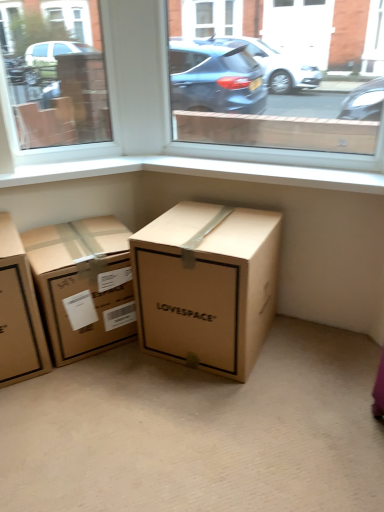
The image size is (384, 512). Find the location of `transparent glass window at center, the 1th window in the right-to-left sequence`. transparent glass window at center, the 1th window in the right-to-left sequence is located at coordinates click(x=151, y=104).

Where is `brown cardboard box at left, the third box from the right`? This screenshot has height=512, width=384. brown cardboard box at left, the third box from the right is located at coordinates (18, 312).

Who is bigger, white smooth window sill at upper center or brown cardboard box at left, the third box from the right?

With larger size is brown cardboard box at left, the third box from the right.

How many degrees apart are the facing directions of white smooth window sill at upper center and brown cardboard box at left, the third box from the right?

There is a 52.1-degree angle between the facing directions of white smooth window sill at upper center and brown cardboard box at left, the third box from the right.

Consider the image. Is white smooth window sill at upper center not inside brown cardboard box at left, the third box from the right?

Indeed, white smooth window sill at upper center is completely outside brown cardboard box at left, the third box from the right.

Considering the relative sizes of white smooth window sill at upper center and brown cardboard box at left, the third box from the right, in the image provided, is white smooth window sill at upper center thinner than brown cardboard box at left, the third box from the right,?

Indeed, white smooth window sill at upper center has a lesser width compared to brown cardboard box at left, the third box from the right.

Would you say brown cardboard box at center, positioned as the second box in left-to-right order, contains brown cardboard box at left, the first box viewed from the left?

Definitely not — brown cardboard box at left, the first box viewed from the left, is not inside brown cardboard box at center, positioned as the second box in left-to-right order.

From a real-world perspective, between brown cardboard box at center, positioned as the second box in left-to-right order, and brown cardboard box at left, the first box viewed from the left, who is vertically lower?

From a 3D spatial view, brown cardboard box at center, positioned as the second box in left-to-right order, is below.

Looking at their sizes, would you say brown cardboard box at center, which is the 2th box in right-to-left order, is wider or thinner than brown cardboard box at left, the first box viewed from the left?

Clearly, brown cardboard box at center, which is the 2th box in right-to-left order, has less width compared to brown cardboard box at left, the first box viewed from the left.

Is brown cardboard box at center, positioned as the second box in left-to-right order, turned away from brown cardboard box at left, the third box from the right?

No, brown cardboard box at center, positioned as the second box in left-to-right order, is not facing away from brown cardboard box at left, the third box from the right.

Would you say brown cardboard box at left, the first box viewed from the left, is to the left or to the right of white smooth window sill at upper center in the picture?

brown cardboard box at left, the first box viewed from the left, is positioned on white smooth window sill at upper center's left side.

Locate an element on the screen. The image size is (384, 512). window sill behind the brown cardboard box at left, the third box from the right is located at coordinates (199, 172).

Is brown cardboard box at left, the first box viewed from the left, oriented towards white smooth window sill at upper center?

No, brown cardboard box at left, the first box viewed from the left, is not facing towards white smooth window sill at upper center.

Consider the image. Which object is thinner, brown cardboard box at left, the third box from the right, or white smooth window sill at upper center?

Thinner between the two is white smooth window sill at upper center.

From the picture: Is brown cardboard box at center, positioned as the first box in right-to-left order, inside the boundaries of brown cardboard box at center, which is the 2th box in right-to-left order, or outside?

brown cardboard box at center, positioned as the first box in right-to-left order, cannot be found inside brown cardboard box at center, which is the 2th box in right-to-left order.

From a real-world perspective, relative to brown cardboard box at center, which is the 2th box in right-to-left order, is brown cardboard box at center, positioned as the first box in right-to-left order, vertically above or below?

brown cardboard box at center, positioned as the first box in right-to-left order, is above brown cardboard box at center, which is the 2th box in right-to-left order.

I want to click on box on the right of brown cardboard box at center, positioned as the second box in left-to-right order, so click(x=207, y=284).

How far apart are brown cardboard box at center, the 3th box in the left-to-right sequence, and brown cardboard box at center, which is the 2th box in right-to-left order?

The distance of brown cardboard box at center, the 3th box in the left-to-right sequence, from brown cardboard box at center, which is the 2th box in right-to-left order, is 10.74 inches.

Considering the relative positions of brown cardboard box at left, the first box viewed from the left, and brown cardboard box at center, positioned as the second box in left-to-right order, in the image provided, is brown cardboard box at left, the first box viewed from the left, behind brown cardboard box at center, positioned as the second box in left-to-right order,?

No, brown cardboard box at left, the first box viewed from the left, is in front of brown cardboard box at center, positioned as the second box in left-to-right order.

Between brown cardboard box at left, the third box from the right, and brown cardboard box at center, positioned as the second box in left-to-right order, which one has smaller size?

brown cardboard box at left, the third box from the right, is smaller.

Which is more to the left, brown cardboard box at left, the first box viewed from the left, or brown cardboard box at center, positioned as the second box in left-to-right order?

Positioned to the left is brown cardboard box at left, the first box viewed from the left.

Is there a large distance between brown cardboard box at left, the third box from the right, and brown cardboard box at center, which is the 2th box in right-to-left order?

No, brown cardboard box at left, the third box from the right, is not far away from brown cardboard box at center, which is the 2th box in right-to-left order.

Who is more distant, brown cardboard box at center, positioned as the second box in left-to-right order, or brown cardboard box at center, positioned as the first box in right-to-left order?

Positioned behind is brown cardboard box at center, positioned as the second box in left-to-right order.

From their relative heights in the image, would you say brown cardboard box at center, positioned as the second box in left-to-right order, is taller or shorter than brown cardboard box at center, positioned as the first box in right-to-left order?

In the image, brown cardboard box at center, positioned as the second box in left-to-right order, appears to be shorter than brown cardboard box at center, positioned as the first box in right-to-left order.

Is brown cardboard box at center, positioned as the second box in left-to-right order, in contact with brown cardboard box at center, positioned as the first box in right-to-left order?

They are not placed beside each other.

In terms of size, does brown cardboard box at center, positioned as the second box in left-to-right order, appear bigger or smaller than brown cardboard box at center, the 3th box in the left-to-right sequence?

Clearly, brown cardboard box at center, positioned as the second box in left-to-right order, is smaller in size than brown cardboard box at center, the 3th box in the left-to-right sequence.

Can you confirm if transparent glass window at center, the 1th window in the right-to-left sequence, is smaller than transparent glass window at upper left, which ranks as the second window in right-to-left order?

Incorrect, transparent glass window at center, the 1th window in the right-to-left sequence, is not smaller in size than transparent glass window at upper left, which ranks as the second window in right-to-left order.

Can you see transparent glass window at center, which is counted as the 2th window, starting from the left, touching transparent glass window at upper left, acting as the 1th window starting from the left?

They are not placed beside each other.

How distant is transparent glass window at center, which is counted as the 2th window, starting from the left, from transparent glass window at upper left, acting as the 1th window starting from the left?

transparent glass window at center, which is counted as the 2th window, starting from the left, is 7.90 feet away from transparent glass window at upper left, acting as the 1th window starting from the left.

From the image's perspective, is transparent glass window at center, the 1th window in the right-to-left sequence, located above transparent glass window at upper left, which ranks as the second window in right-to-left order?

Incorrect, from the image's perspective, transparent glass window at center, the 1th window in the right-to-left sequence, is lower than transparent glass window at upper left, which ranks as the second window in right-to-left order.

You are a GUI agent. You are given a task and a screenshot of the screen. Output one action in this format:
    pyautogui.click(x=<x>, y=<y>)
    Task: Click on the window sill on the right of the brown cardboard box at left, the third box from the right
    The height and width of the screenshot is (512, 384).
    Given the screenshot: What is the action you would take?
    pyautogui.click(x=199, y=172)

You are a GUI agent. You are given a task and a screenshot of the screen. Output one action in this format:
    pyautogui.click(x=<x>, y=<y>)
    Task: Click on the box below the brown cardboard box at center, positioned as the second box in left-to-right order (from the image's perspective)
    The width and height of the screenshot is (384, 512).
    Given the screenshot: What is the action you would take?
    pyautogui.click(x=18, y=312)

Looking at the image, which one is located closer to transparent glass window at center, the 1th window in the right-to-left sequence, white smooth window sill at upper center or brown cardboard box at center, positioned as the second box in left-to-right order?

The object closer to transparent glass window at center, the 1th window in the right-to-left sequence, is white smooth window sill at upper center.

From the image, which object appears to be nearer to white smooth window sill at upper center, transparent glass window at upper left, acting as the 1th window starting from the left, or brown cardboard box at center, positioned as the first box in right-to-left order?

Among the two, brown cardboard box at center, positioned as the first box in right-to-left order, is located nearer to white smooth window sill at upper center.

Based on their spatial positions, is transparent glass window at center, the 1th window in the right-to-left sequence, or transparent glass window at upper left, which ranks as the second window in right-to-left order, closer to brown cardboard box at center, the 3th box in the left-to-right sequence?

transparent glass window at center, the 1th window in the right-to-left sequence.

Estimate the real-world distances between objects in this image. Which object is further from transparent glass window at center, the 1th window in the right-to-left sequence, brown cardboard box at center, positioned as the first box in right-to-left order, or transparent glass window at upper left, acting as the 1th window starting from the left?

transparent glass window at upper left, acting as the 1th window starting from the left, is further to transparent glass window at center, the 1th window in the right-to-left sequence.

Based on their spatial positions, is brown cardboard box at center, which is the 2th box in right-to-left order, or transparent glass window at center, the 1th window in the right-to-left sequence, closer to brown cardboard box at left, the third box from the right?

Based on the image, brown cardboard box at center, which is the 2th box in right-to-left order, appears to be nearer to brown cardboard box at left, the third box from the right.

From the image, which object appears to be nearer to brown cardboard box at center, which is the 2th box in right-to-left order, white smooth window sill at upper center or transparent glass window at upper left, which ranks as the second window in right-to-left order?

white smooth window sill at upper center is positioned closer to the anchor brown cardboard box at center, which is the 2th box in right-to-left order.

From the image, which object appears to be farther from white smooth window sill at upper center, transparent glass window at upper left, which ranks as the second window in right-to-left order, or transparent glass window at center, which is counted as the 2th window, starting from the left?

Based on the image, transparent glass window at upper left, which ranks as the second window in right-to-left order, appears to be further to white smooth window sill at upper center.

Which object lies further to the anchor point transparent glass window at upper left, acting as the 1th window starting from the left, brown cardboard box at center, the 3th box in the left-to-right sequence, or white smooth window sill at upper center?

brown cardboard box at center, the 3th box in the left-to-right sequence.

Identify the location of window between transparent glass window at upper left, acting as the 1th window starting from the left, and brown cardboard box at center, which is the 2th box in right-to-left order, from top to bottom. (151, 104).

The height and width of the screenshot is (512, 384). Find the location of `window sill situated between brown cardboard box at left, the first box viewed from the left, and transparent glass window at center, the 1th window in the right-to-left sequence, from left to right`. window sill situated between brown cardboard box at left, the first box viewed from the left, and transparent glass window at center, the 1th window in the right-to-left sequence, from left to right is located at coordinates (199, 172).

You are a GUI agent. You are given a task and a screenshot of the screen. Output one action in this format:
    pyautogui.click(x=<x>, y=<y>)
    Task: Click on the window between transparent glass window at upper left, acting as the 1th window starting from the left, and brown cardboard box at center, the 3th box in the left-to-right sequence, in the vertical direction
    This screenshot has height=512, width=384.
    Given the screenshot: What is the action you would take?
    pyautogui.click(x=151, y=104)

I want to click on box between brown cardboard box at left, the third box from the right, and brown cardboard box at center, the 3th box in the left-to-right sequence, in the horizontal direction, so click(83, 285).